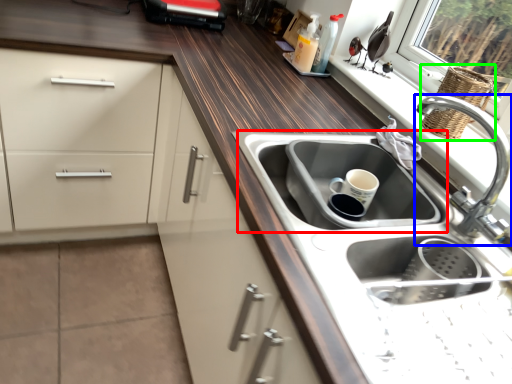
Question: Which object is positioned farthest from sink (highlighted by a red box)? Select from tap (highlighted by a blue box) and basket (highlighted by a green box).

Choices:
 (A) tap
 (B) basket

Answer: (B)